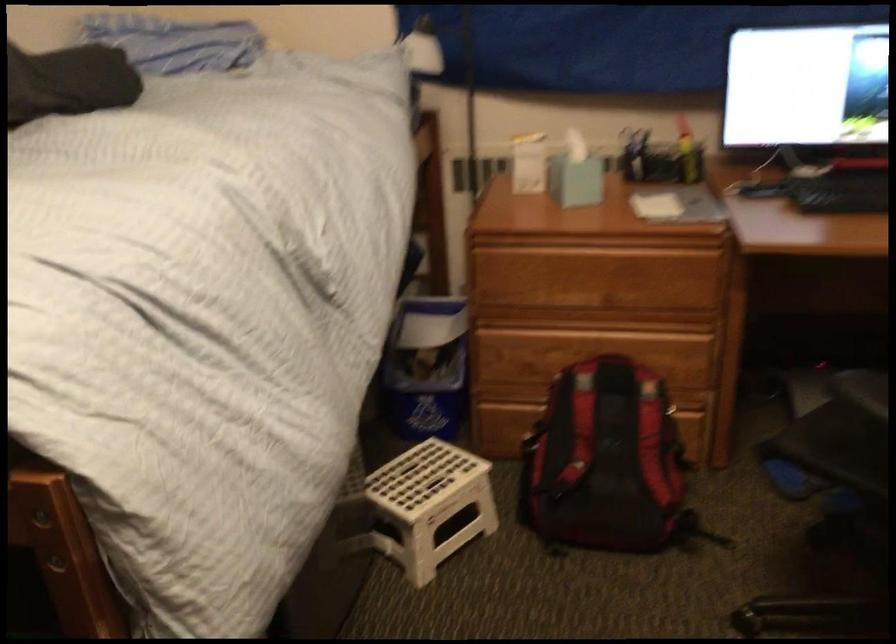
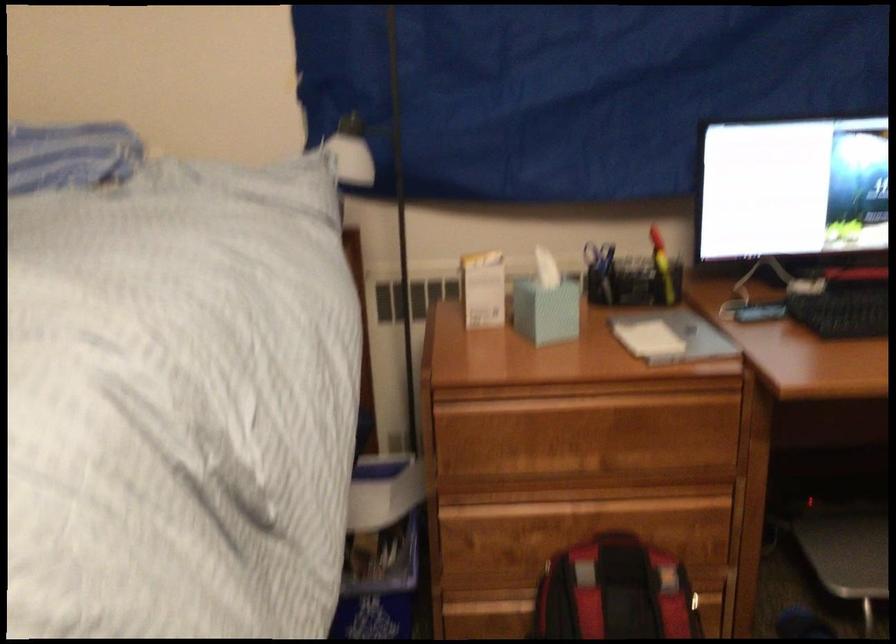
Find the pixel in the second image that matches (527,251) in the first image.

(497, 406)